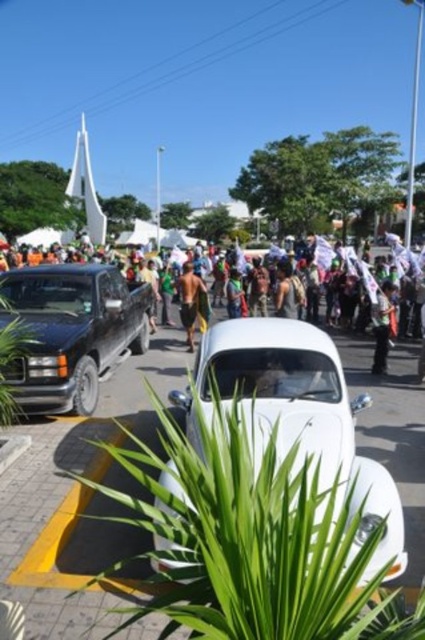
Is point (323, 428) behind point (192, 314)?

No, it is in front of (192, 314).

Can you confirm if white glossy car at center is positioned above brown textured shorts at center?

No, white glossy car at center is not above brown textured shorts at center.

Does point (402, 564) come behind point (190, 291)?

No.

At what (x,y) coordinates should I click in order to perform the action: click on white glossy car at center. Please return your answer as a coordinate pair (x, y). Image resolution: width=425 pixels, height=640 pixels. Looking at the image, I should click on [303, 417].

Does point (79, 305) come farther from viewer compared to point (200, 289)?

No, (79, 305) is closer to viewer.

Can you confirm if shiny black truck at center is positioned to the left of brown textured shorts at center?

Indeed, shiny black truck at center is positioned on the left side of brown textured shorts at center.

At what (x,y) coordinates should I click in order to perform the action: click on shiny black truck at center. Please return your answer as a coordinate pair (x, y). This screenshot has height=640, width=425. Looking at the image, I should click on (71, 332).

Does white glossy car at center appear on the right side of shiny black truck at center?

Yes, white glossy car at center is to the right of shiny black truck at center.

How far apart are white glossy car at center and shiny black truck at center?

white glossy car at center is 3.36 meters away from shiny black truck at center.

Image resolution: width=425 pixels, height=640 pixels. What do you see at coordinates (303, 417) in the screenshot? I see `white glossy car at center` at bounding box center [303, 417].

Where is `white glossy car at center`? This screenshot has width=425, height=640. white glossy car at center is located at coordinates pyautogui.click(x=303, y=417).